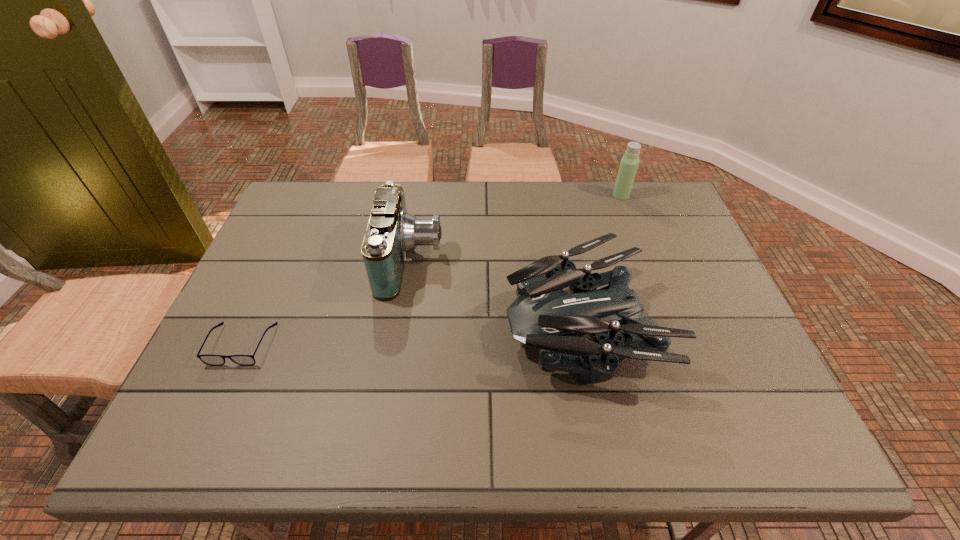
Locate an element on the screen. This screenshot has width=960, height=540. free space that satisfies the following two spatial constraints: 1. on the front-facing side of the camcorder; 2. on the back side of the second shortest object is located at coordinates (401, 323).

Identify the location of free space that satisfies the following two spatial constraints: 1. on the front side of the thermos bottle; 2. on the front-facing side of the second object from left to right. This screenshot has width=960, height=540. (645, 261).

This screenshot has height=540, width=960. Identify the location of blank area in the image that satisfies the following two spatial constraints: 1. on the front-facing side of the third object from right to left; 2. on the front-facing side of the shortest object. (398, 345).

You are a GUI agent. You are given a task and a screenshot of the screen. Output one action in this format:
    pyautogui.click(x=<x>, y=<y>)
    Task: Click on the vacant area that satisfies the following two spatial constraints: 1. on the front side of the thermos bottle; 2. on the front-facing side of the second object from left to right
    
    Given the screenshot: What is the action you would take?
    pyautogui.click(x=645, y=261)

This screenshot has height=540, width=960. Find the location of `vacant space that satisfies the following two spatial constraints: 1. on the front-facing side of the drone; 2. on the left side of the second object from left to right`. vacant space that satisfies the following two spatial constraints: 1. on the front-facing side of the drone; 2. on the left side of the second object from left to right is located at coordinates (401, 323).